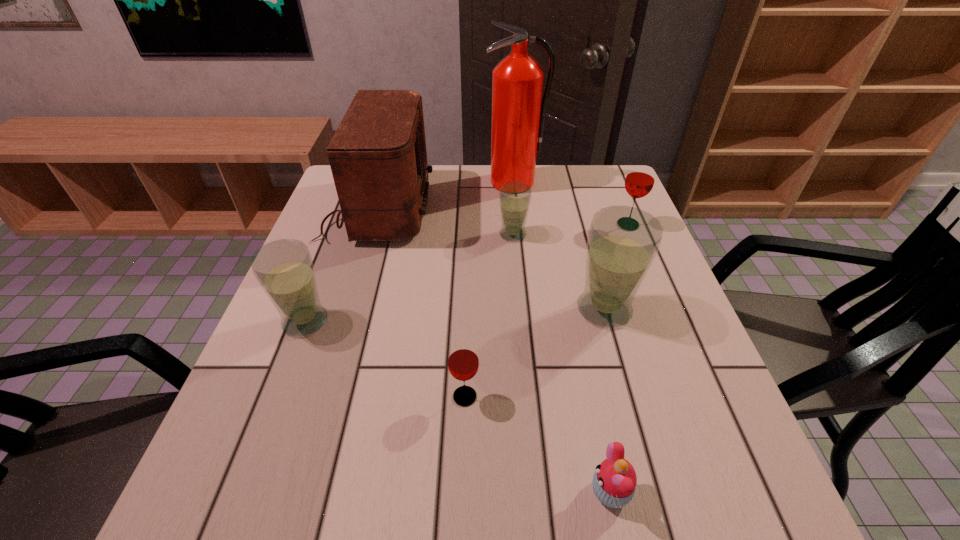
At what (x,y) coordinates should I click in order to perform the action: click on fire extinguisher. Please return your answer as a coordinate pair (x, y). The width and height of the screenshot is (960, 540). Looking at the image, I should click on (518, 116).

Identify the location of the seventh shortest object. (378, 158).

Find the location of `brown radio receiver`. brown radio receiver is located at coordinates (378, 158).

Locate an element on the screen. This screenshot has width=960, height=540. the fourth glass from left to right is located at coordinates (623, 241).

You are a GUI agent. You are given a task and a screenshot of the screen. Output one action in this format:
    pyautogui.click(x=<x>, y=<y>)
    Task: Click on the rightmost blue glass
    Image resolution: width=960 pixels, height=540 pixels.
    Given the screenshot: What is the action you would take?
    pyautogui.click(x=623, y=241)

You are a GUI agent. You are given a task and a screenshot of the screen. Output one action in this format:
    pyautogui.click(x=<x>, y=<y>)
    Task: Click on the bigger red glass
    This screenshot has width=960, height=540.
    Given the screenshot: What is the action you would take?
    [640, 179]

Locate an element on the screen. The image size is (960, 540). the right red glass is located at coordinates (640, 179).

I want to click on the leftmost glass, so click(284, 269).

Identify the location of the second biggest blue glass. (284, 269).

The image size is (960, 540). What are the coordinates of `the second blue glass from right to left` in the screenshot? It's located at (514, 197).